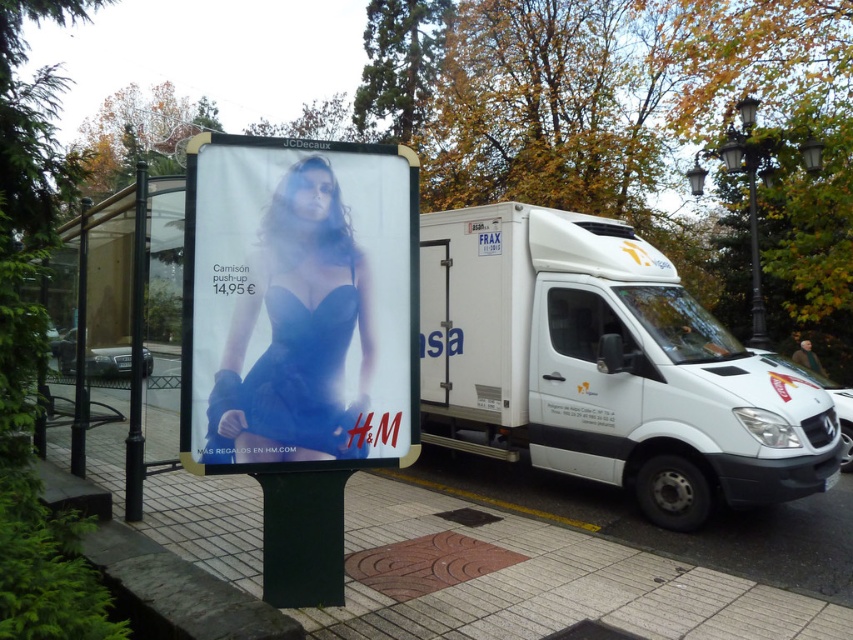
Question: Does matte blue lingerie at center lie behind black metal pole at left?

Choices:
 (A) yes
 (B) no

Answer: (B)

Question: Is white matte van at center smaller than black metal pole at left?

Choices:
 (A) yes
 (B) no

Answer: (B)

Question: Can you confirm if white matte van at center is bigger than black metal pole at left?

Choices:
 (A) no
 (B) yes

Answer: (B)

Question: Considering the real-world distances, which object is closest to the white matte van at center?

Choices:
 (A) black metal pole at left
 (B) matte blue lingerie at center

Answer: (B)

Question: Which of the following is the farthest from the observer?

Choices:
 (A) (135, 172)
 (B) (567, 404)
 (C) (374, 520)

Answer: (A)

Question: Which point is farther to the camera?

Choices:
 (A) (491, 444)
 (B) (229, 259)
 (C) (634, 548)

Answer: (A)